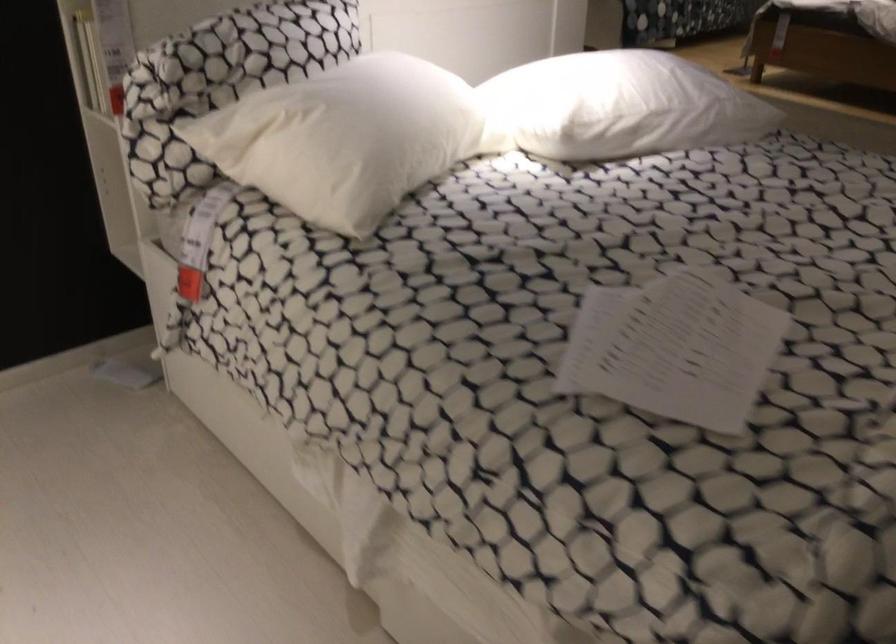
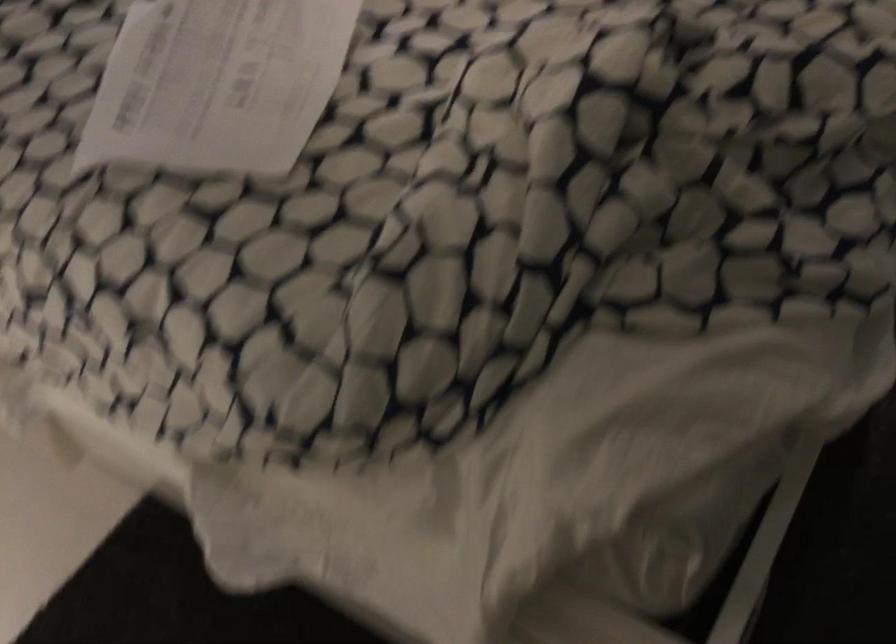
The images are taken continuously from a first-person perspective. In which direction are you moving?

The movement direction of the cameraman is right, forward.